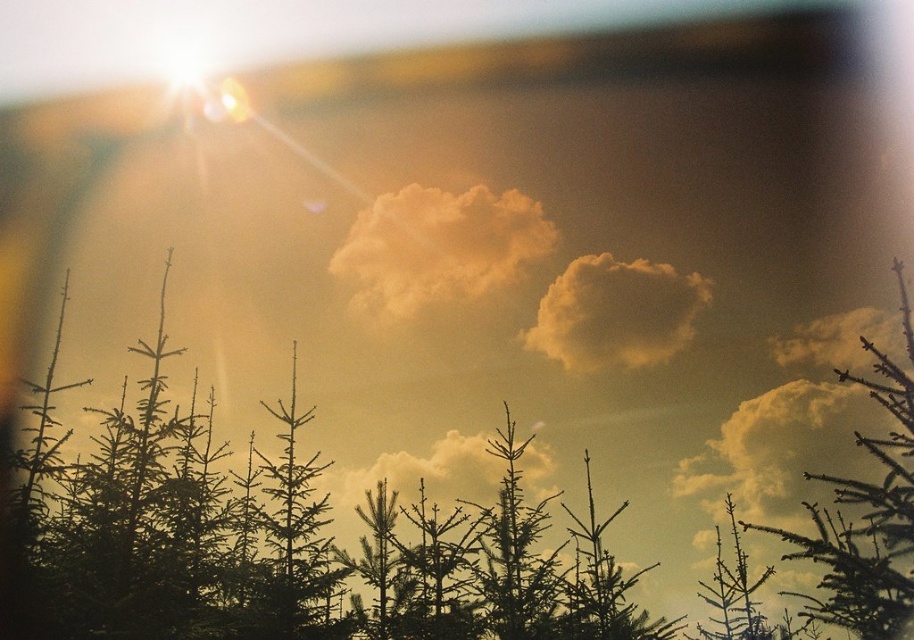
You are an astronomer observing the sky and notice the fuzzy golden cloud at upper center and the cloudy white cloud at upper right. Which cloud is positioned closer to the left side of the sky?

The fuzzy golden cloud at upper center is positioned to the left of the cloudy white cloud at upper right, so it is closer to the left side of the sky.

You are an astronomer analyzing the image. You notice a point labeled as point (781, 448). Based on the scene description, what object is located at that coordinate?

The point (781, 448) marks a fuzzy yellow cloud at upper center.

You are an artist trying to paint the sky scene. You notice the fuzzy golden cloud at upper center and the cloudy white cloud at upper right. Which cloud should you paint first if you want to paint the smaller one before the larger one?

You should paint the fuzzy golden cloud at upper center first because it is smaller than the cloudy white cloud at upper right.